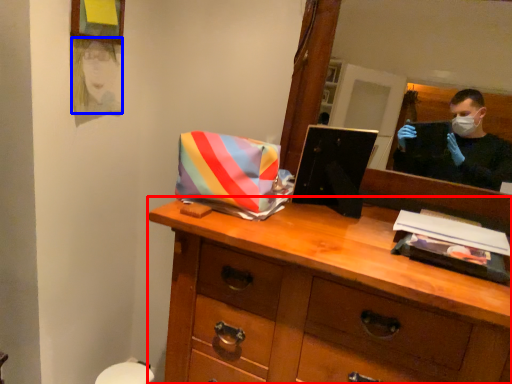
Question: Which point is further to the camera, chest of drawers (highlighted by a red box) or person (highlighted by a blue box)?

Choices:
 (A) chest of drawers
 (B) person

Answer: (B)